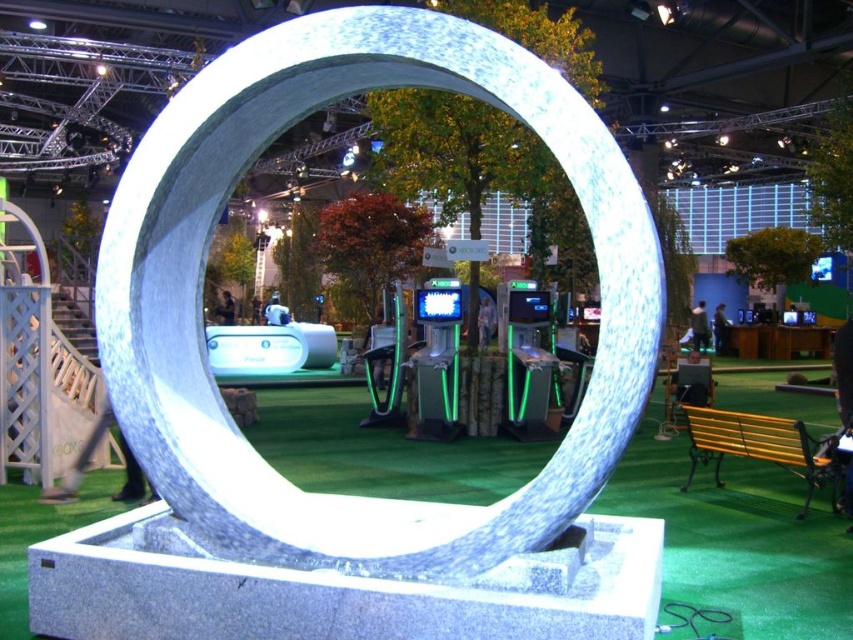
Question: Is white marble ring at center to the left of green artificial turf at center from the viewer's perspective?

Choices:
 (A) yes
 (B) no

Answer: (A)

Question: In this image, where is white marble ring at center located relative to green artificial turf at center?

Choices:
 (A) below
 (B) above

Answer: (B)

Question: Can you confirm if white marble ring at center is positioned to the left of green artificial turf at center?

Choices:
 (A) no
 (B) yes

Answer: (B)

Question: Which object is farther from the camera taking this photo?

Choices:
 (A) green artificial turf at center
 (B) white marble ring at center

Answer: (A)

Question: Which point is closer to the camera taking this photo?

Choices:
 (A) (814, 600)
 (B) (424, 81)

Answer: (B)